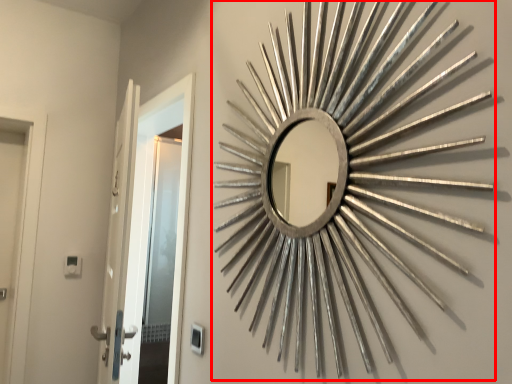
Question: From the image, what is the correct spatial relationship of brass (annotated by the red box) in relation to door?

Choices:
 (A) left
 (B) right

Answer: (B)